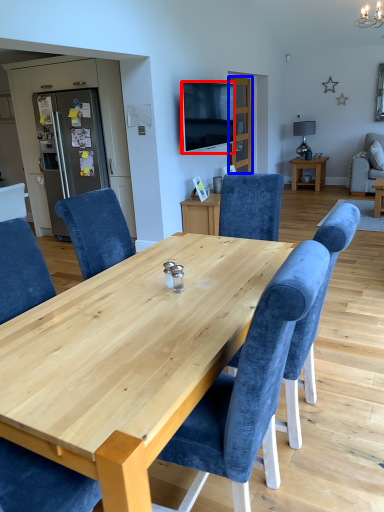
Question: Which object appears closest to the camera in this image, television (highlighted by a red box) or glass door (highlighted by a blue box)?

Choices:
 (A) television
 (B) glass door

Answer: (A)